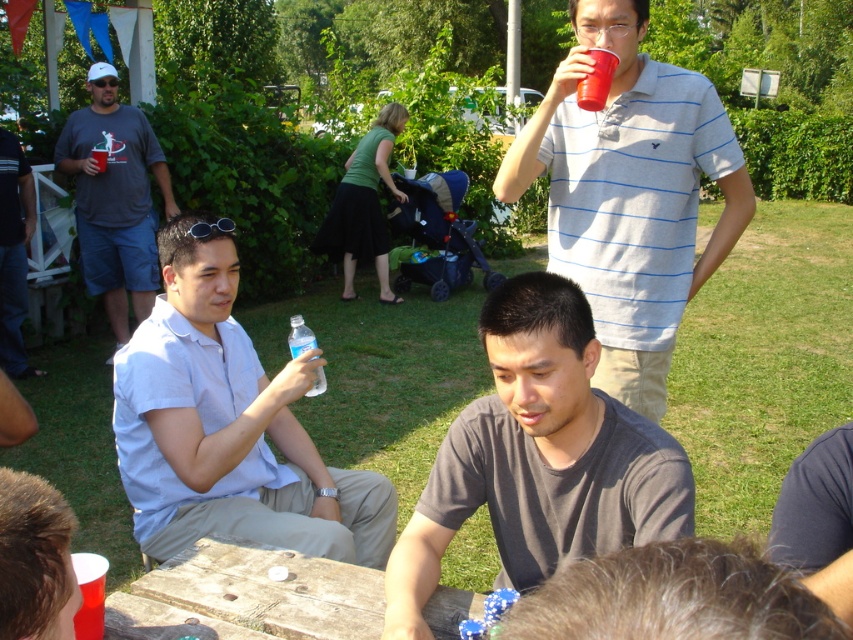
The height and width of the screenshot is (640, 853). I want to click on matte gray shirt at left, so click(x=15, y=252).

Does matte gray shirt at left have a greater width compared to clear plastic water bottle at center?

Indeed, matte gray shirt at left has a greater width compared to clear plastic water bottle at center.

This screenshot has width=853, height=640. In order to click on matte gray shirt at left in this screenshot , I will do `click(15, 252)`.

Identify the location of matte gray shirt at left. Image resolution: width=853 pixels, height=640 pixels. (15, 252).

The image size is (853, 640). What are the coordinates of `dark gray t-shirt at center` in the screenshot? It's located at (538, 458).

Does dark gray t-shirt at center appear on the left side of matte gray shirt at left?

No, dark gray t-shirt at center is not to the left of matte gray shirt at left.

Between point (556, 352) and point (27, 236), which one is positioned behind?

The point (27, 236) is behind.

What are the coordinates of `dark gray t-shirt at center` in the screenshot? It's located at (538, 458).

Is point (167, 193) farther from camera compared to point (38, 374)?

Yes, it is.

From the picture: Is matte gray t-shirt at left bigger than matte gray shirt at left?

Yes.

Is point (103, 196) behind point (0, 285)?

Yes.

Where is `matte gray t-shirt at left`? matte gray t-shirt at left is located at coordinates (115, 198).